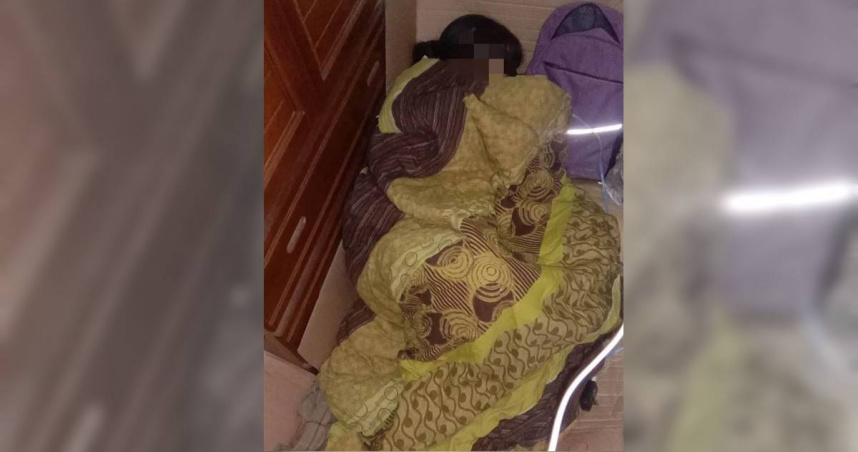
This screenshot has width=858, height=452. In order to click on wall in this screenshot , I will do `click(515, 16)`.